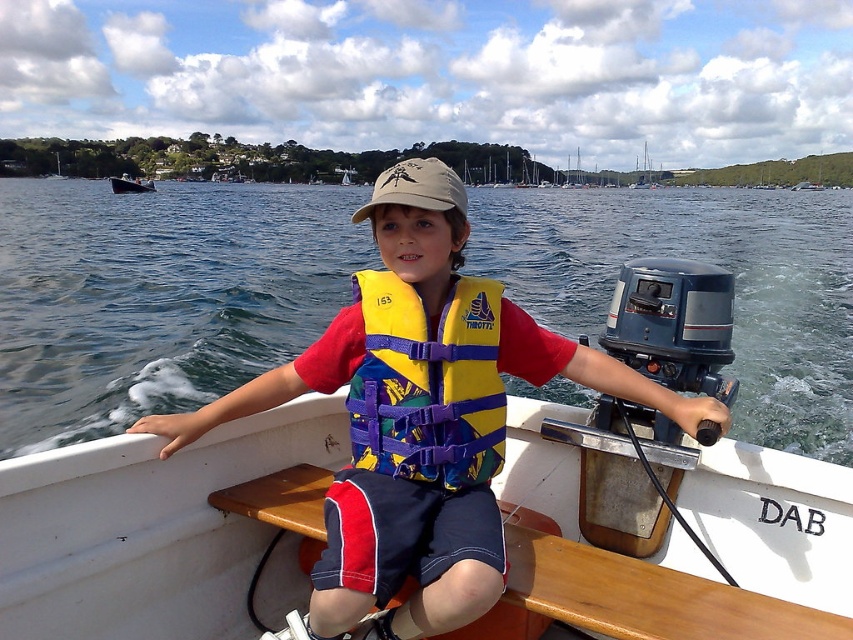
Question: Observing the image, what is the correct spatial positioning of blue water at center in reference to yellow/purple fabric life vest at center?

Choices:
 (A) left
 (B) right

Answer: (B)

Question: Does blue water at center appear under brushed metal boat at upper left?

Choices:
 (A) no
 (B) yes

Answer: (B)

Question: Does yellow fabric life vest at center appear on the left side of brushed metal boat at upper left?

Choices:
 (A) no
 (B) yes

Answer: (A)

Question: Which of the following is the farthest from the observer?

Choices:
 (A) (131, 193)
 (B) (440, 444)
 (C) (822, 218)

Answer: (A)

Question: Among these objects, which one is nearest to the camera?

Choices:
 (A) brushed metal boat at upper left
 (B) blue water at center

Answer: (B)

Question: Among these objects, which one is nearest to the camera?

Choices:
 (A) yellow fabric life vest at center
 (B) brushed metal boat at upper left
 (C) blue water at center

Answer: (A)